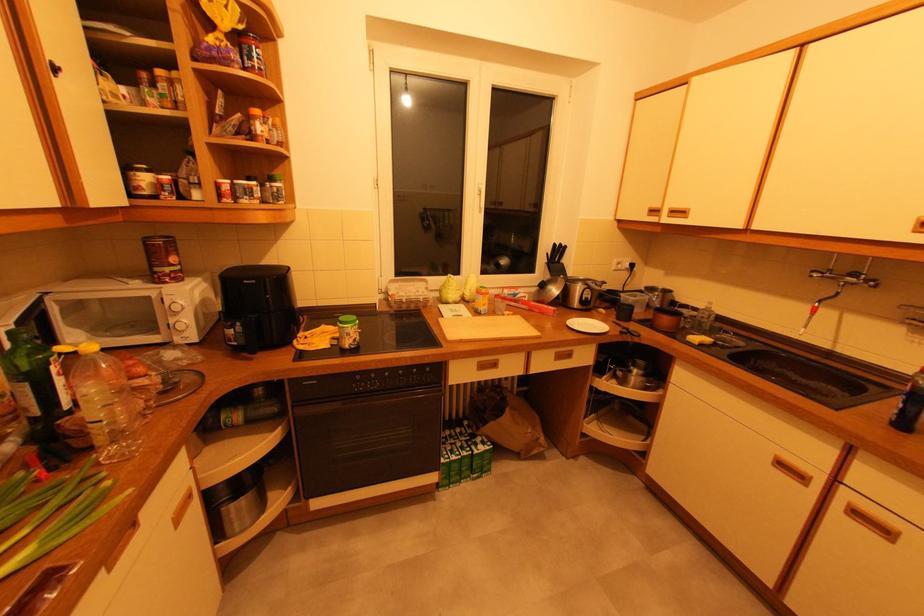
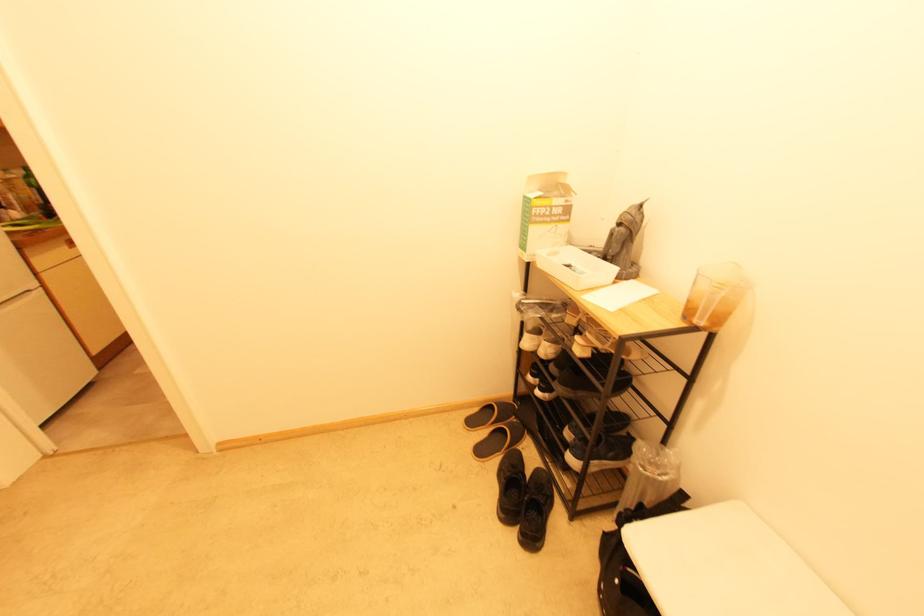
Question: I am providing you with two images of the same scene from different viewpoints. Please identify which objects are invisible in image2.

Choices:
 (A) black sneaker
 (B) chair sitting surface
 (C) faucet lever
 (D) white airplane model

Answer: (C)